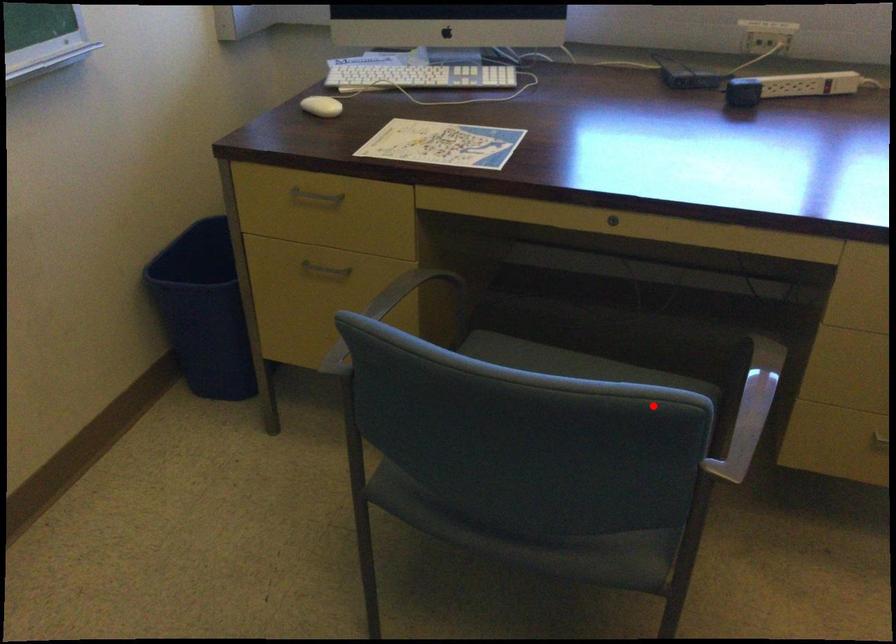
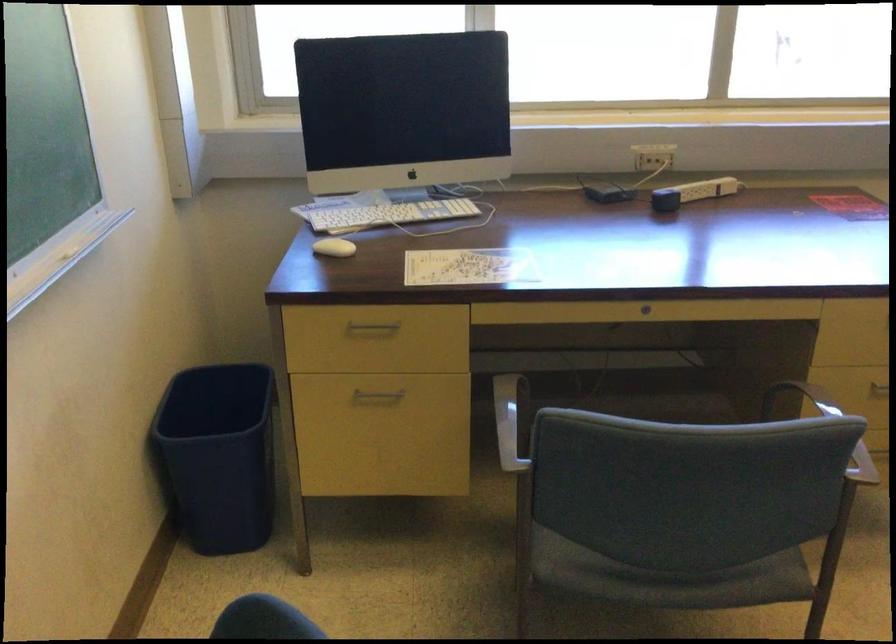
Question: I am providing you with two images of the same scene from different viewpoints. A red point is shown in image1. For the corresponding object point in image2, is it positioned nearer or farther from the camera?

Choices:
 (A) Nearer
 (B) Farther

Answer: (B)